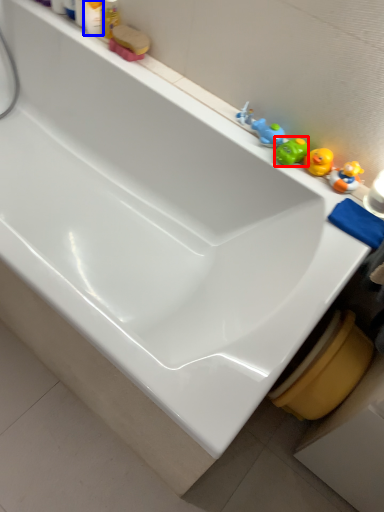
Question: Which object appears farthest to the camera in this image, toy (highlighted by a red box) or toiletry (highlighted by a blue box)?

Choices:
 (A) toy
 (B) toiletry

Answer: (B)